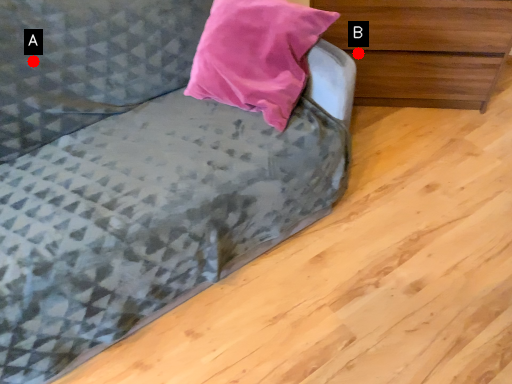
Question: Two points are circled on the image, labeled by A and B beside each circle. Which point appears farthest from the camera in this image?

Choices:
 (A) A is further
 (B) B is further

Answer: (B)